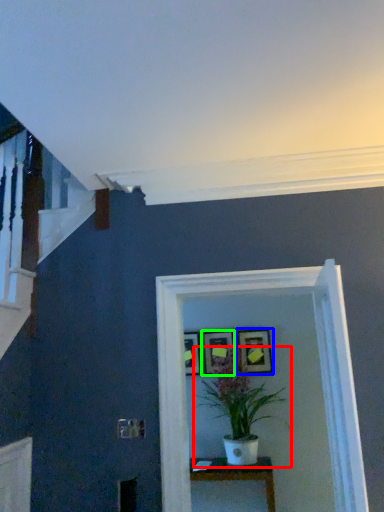
Question: Which is farther away from houseplant (highlighted by a red box)? picture frame (highlighted by a blue box) or picture frame (highlighted by a green box)?

Choices:
 (A) picture frame
 (B) picture frame

Answer: (B)